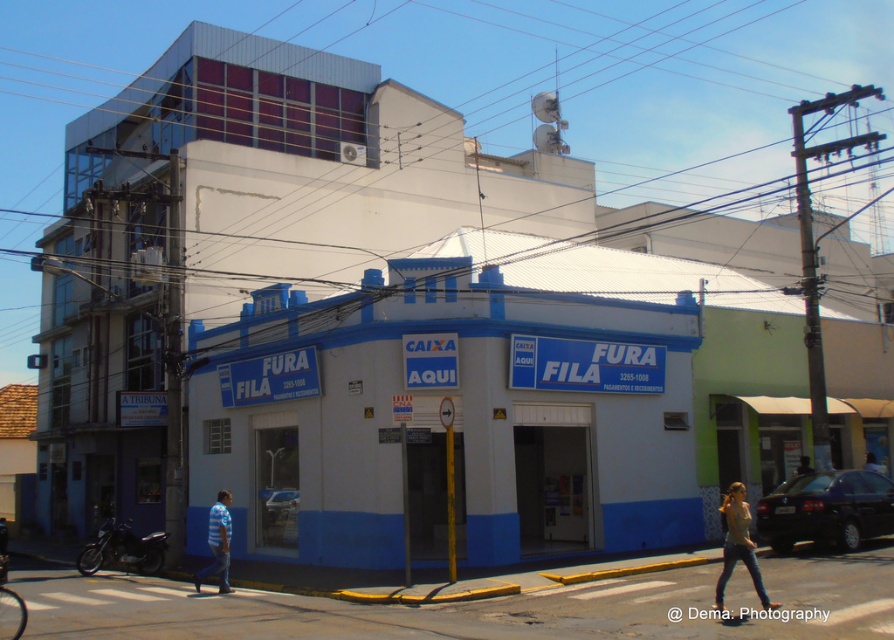
Looking at this image, please provide the exact 2D coordinates of the matte gray tank top at center in the image. The coordinates should be in the format of a point with two decimal places, such as point 0.5,0.5.

The exact 2D coordinates of the matte gray tank top at center are point (x=738, y=545).